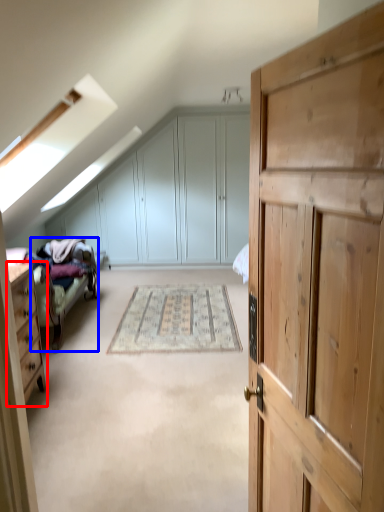
Question: Among these objects, which one is farthest to the camera, chest of drawers (highlighted by a red box) or bed frame (highlighted by a blue box)?

Choices:
 (A) chest of drawers
 (B) bed frame

Answer: (B)